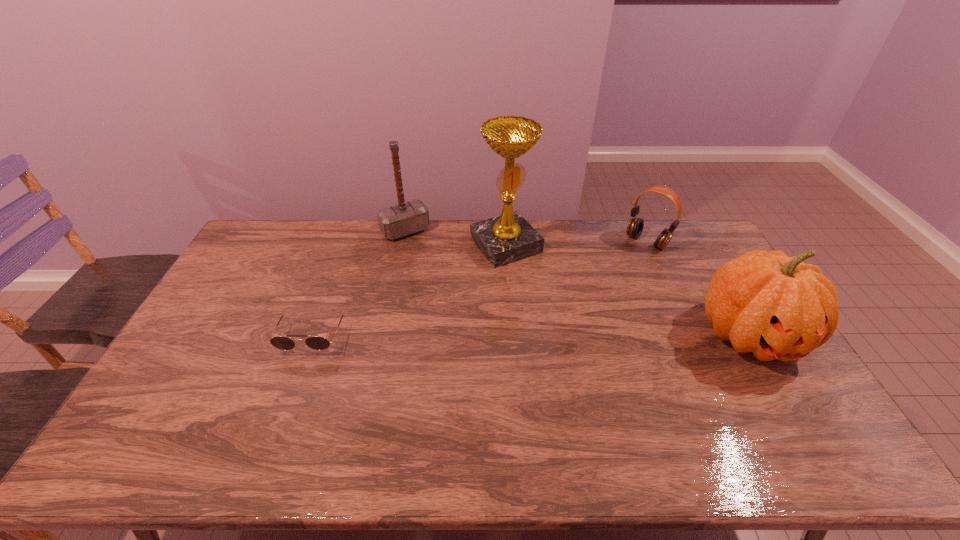
At what (x,y) coordinates should I click in order to perform the action: click on free space located on the ear cups of the headset. Please return your answer as a coordinate pair (x, y). Image resolution: width=960 pixels, height=540 pixels. Looking at the image, I should click on (612, 277).

The height and width of the screenshot is (540, 960). Identify the location of free space located on the ear cups of the headset. (618, 271).

Locate an element on the screen. Image resolution: width=960 pixels, height=540 pixels. free space located 0.070m on the front-facing side of the award is located at coordinates (535, 278).

In order to click on vacant area situated 0.170m on the front-facing side of the award in this screenshot , I will do `click(550, 295)`.

At what (x,y) coordinates should I click in order to perform the action: click on vacant space located on the front-facing side of the award. Please return your answer as a coordinate pair (x, y). Looking at the image, I should click on (573, 322).

The height and width of the screenshot is (540, 960). In order to click on vacant space located 0.280m on the striking surface of the hammer in this screenshot , I will do `click(448, 285)`.

This screenshot has width=960, height=540. Find the location of `vacant point located 0.290m on the striking surface of the hammer`. vacant point located 0.290m on the striking surface of the hammer is located at coordinates (449, 287).

The width and height of the screenshot is (960, 540). I want to click on vacant area situated 0.320m on the striking surface of the hammer, so click(453, 292).

You are a GUI agent. You are given a task and a screenshot of the screen. Output one action in this format:
    pyautogui.click(x=<x>, y=<y>)
    Task: Click on the headset that is at the far edge
    The width and height of the screenshot is (960, 540).
    Given the screenshot: What is the action you would take?
    pyautogui.click(x=635, y=226)

At what (x,y) coordinates should I click in order to perform the action: click on award at the far edge. Please return your answer as a coordinate pair (x, y). This screenshot has height=540, width=960. Looking at the image, I should click on (507, 238).